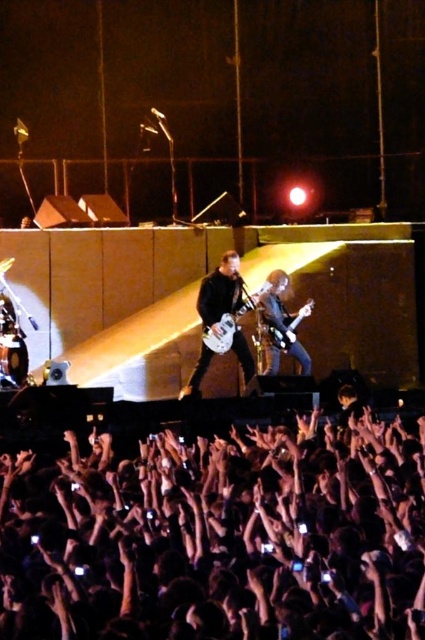
Question: Is shiny brown guitar at center below matte black guitar at center?

Choices:
 (A) no
 (B) yes

Answer: (B)

Question: Does dark skin tone hands at lower center appear on the left side of shiny silver guitar at center?

Choices:
 (A) yes
 (B) no

Answer: (A)

Question: Which object is positioned closest to the matte black guitar at center?

Choices:
 (A) shiny silver guitar at center
 (B) shiny brown guitar at center
 (C) shiny black guitar at center
 (D) dark skin tone hands at lower center

Answer: (C)

Question: Which is farther from the shiny brown guitar at center?

Choices:
 (A) shiny silver guitar at center
 (B) dark skin tone hands at lower center

Answer: (B)

Question: Which object is positioned closest to the dark skin tone hands at lower center?

Choices:
 (A) shiny brown guitar at center
 (B) shiny silver guitar at center
 (C) matte black guitar at center

Answer: (C)

Question: Is dark skin tone hands at lower center to the right of shiny silver guitar at center from the viewer's perspective?

Choices:
 (A) no
 (B) yes

Answer: (A)